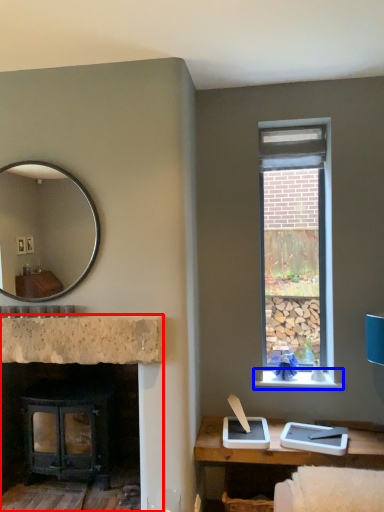
Question: Which object is further to the camera taking this photo, fireplace (highlighted by a red box) or window sill (highlighted by a blue box)?

Choices:
 (A) fireplace
 (B) window sill

Answer: (B)